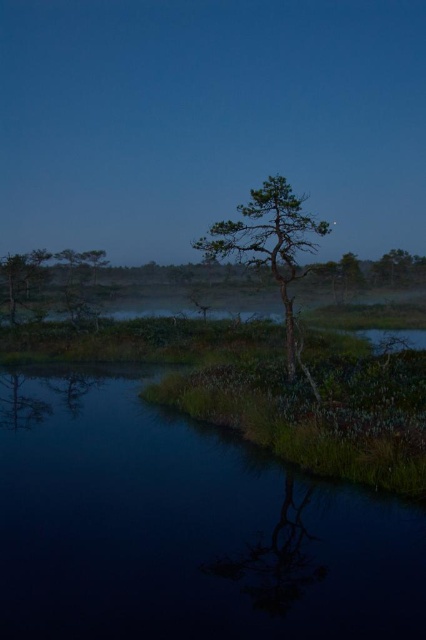
Does point (317, 614) come behind point (48, 285)?

No, (317, 614) is in front of (48, 285).

Identify the location of transparent water at lower center. (184, 528).

How distant is green matte tree at center from green matte tree at left?

15.51 meters

Is green matte tree at center in front of green matte tree at left?

Yes.

Between point (230, 252) and point (34, 250), which one is positioned behind?

The point (34, 250) is more distant.

The width and height of the screenshot is (426, 640). I want to click on green matte tree at center, so click(x=268, y=243).

Between point (48, 637) and point (20, 296), which one is positioned in front?

Point (48, 637) is in front.

The width and height of the screenshot is (426, 640). What do you see at coordinates (184, 528) in the screenshot?
I see `transparent water at lower center` at bounding box center [184, 528].

Between point (296, 628) and point (14, 296), which one is positioned behind?

The point (14, 296) is behind.

Find the location of a particular element. Image resolution: width=426 pixels, height=640 pixels. transparent water at lower center is located at coordinates point(184,528).